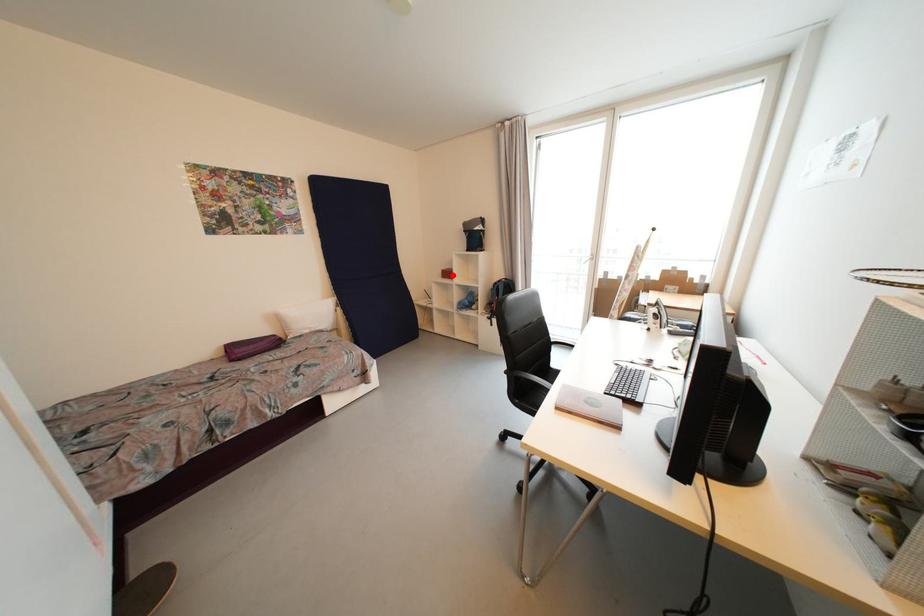
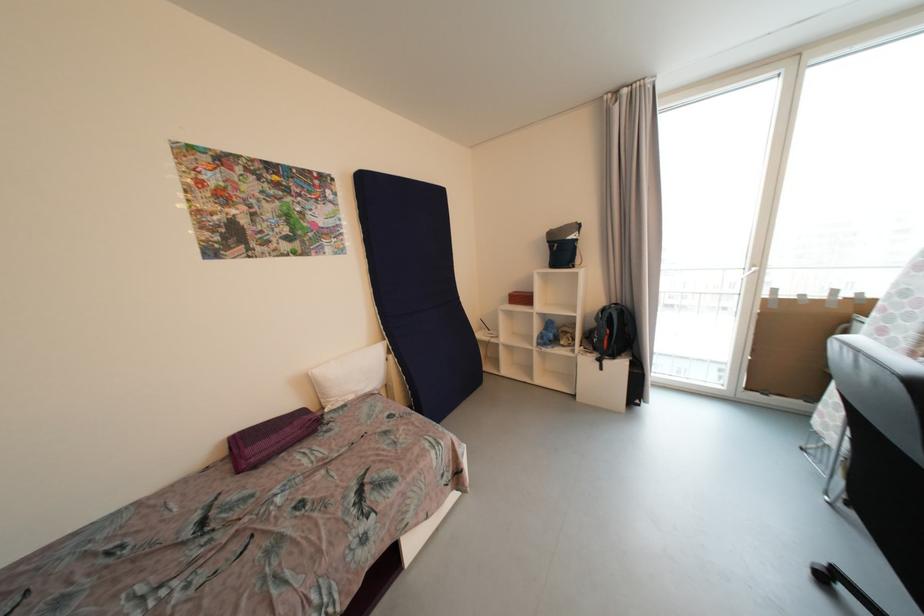
Where in the second image is the point corresponding to the highlighted location from the first image?

(528, 300)